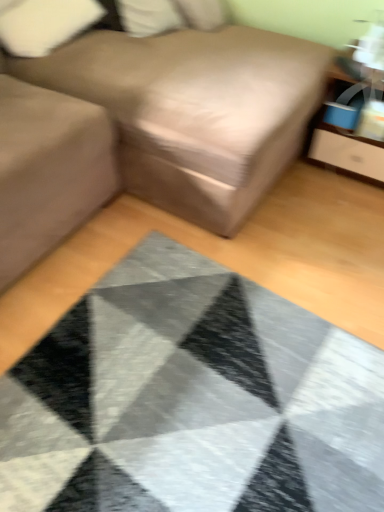
Question: From the image's perspective, does white soft pillow at upper center, positioned as the 2th pillow in left-to-right order, appear higher than brown fabric couch at center?

Choices:
 (A) yes
 (B) no

Answer: (A)

Question: Would you consider white soft pillow at upper center, the first pillow in the right-to-left sequence, to be distant from brown fabric couch at center?

Choices:
 (A) yes
 (B) no

Answer: (B)

Question: Does white soft pillow at upper center, positioned as the 2th pillow in left-to-right order, have a larger size compared to brown fabric couch at center?

Choices:
 (A) no
 (B) yes

Answer: (A)

Question: From a real-world perspective, is white soft pillow at upper center, positioned as the 2th pillow in left-to-right order, on top of brown fabric couch at center?

Choices:
 (A) yes
 (B) no

Answer: (A)

Question: Is white soft pillow at upper center, the first pillow in the right-to-left sequence, positioned with its back to brown fabric couch at center?

Choices:
 (A) yes
 (B) no

Answer: (A)

Question: Is matte wood dresser at upper right bigger or smaller than textured gray mat at center?

Choices:
 (A) big
 (B) small

Answer: (B)

Question: Considering the positions of point (334, 71) and point (375, 355), is point (334, 71) closer or farther from the camera than point (375, 355)?

Choices:
 (A) closer
 (B) farther

Answer: (B)

Question: Considering the positions of matte wood dresser at upper right and textured gray mat at center in the image, is matte wood dresser at upper right taller or shorter than textured gray mat at center?

Choices:
 (A) tall
 (B) short

Answer: (A)

Question: Relative to textured gray mat at center, is matte wood dresser at upper right in front or behind?

Choices:
 (A) behind
 (B) front

Answer: (A)

Question: Is point (322, 144) closer or farther from the camera than point (82, 20)?

Choices:
 (A) closer
 (B) farther

Answer: (A)

Question: From a real-world perspective, is matte wood dresser at upper right positioned above or below white fabric pillow at upper left, the first pillow in the left-to-right sequence?

Choices:
 (A) above
 (B) below

Answer: (B)

Question: Relative to white fabric pillow at upper left, the first pillow in the left-to-right sequence, is matte wood dresser at upper right in front or behind?

Choices:
 (A) behind
 (B) front

Answer: (B)

Question: Is matte wood dresser at upper right wider or thinner than white fabric pillow at upper left, the first pillow in the left-to-right sequence?

Choices:
 (A) thin
 (B) wide

Answer: (B)

Question: Is white fabric pillow at upper left, the first pillow in the left-to-right sequence, wider or thinner than matte wood dresser at upper right?

Choices:
 (A) thin
 (B) wide

Answer: (A)

Question: From the image's perspective, is white fabric pillow at upper left, placed as the second pillow when sorted from right to left, located above or below matte wood dresser at upper right?

Choices:
 (A) above
 (B) below

Answer: (A)